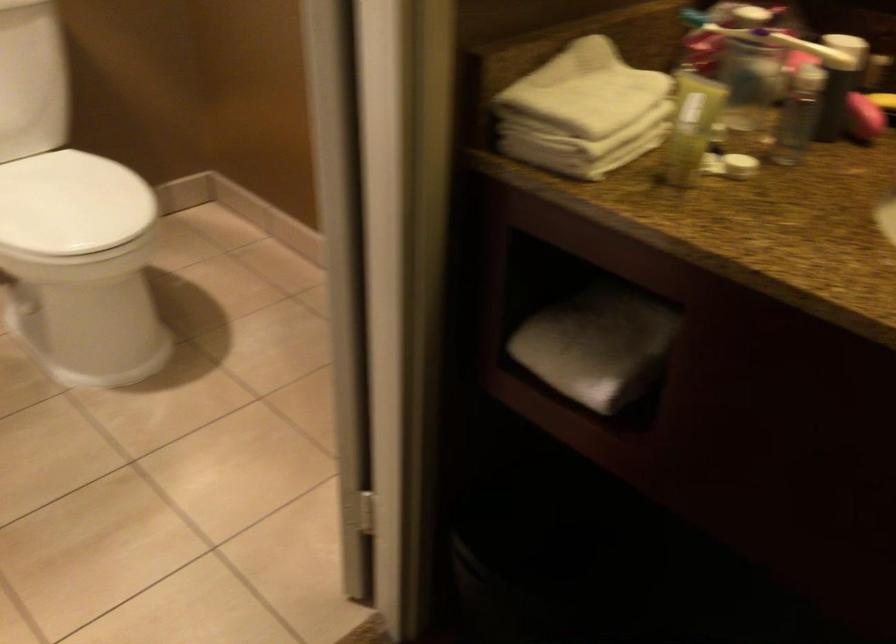
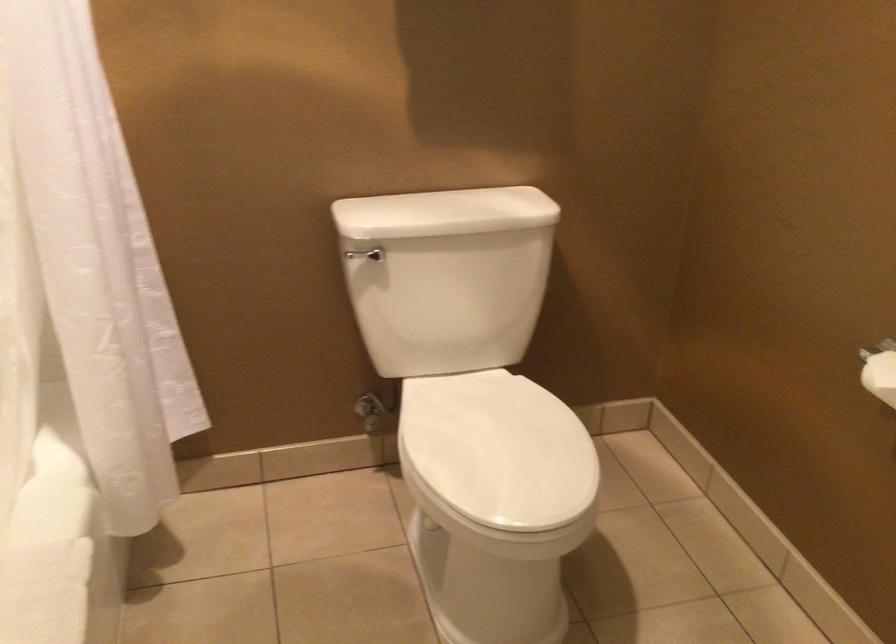
Question: The camera is either moving clockwise (left) or counter-clockwise (right) around the object. The first image is from the beginning of the video and the second image is from the end. Is the camera moving left or right when shooting the video?

Choices:
 (A) Left
 (B) Right

Answer: (B)